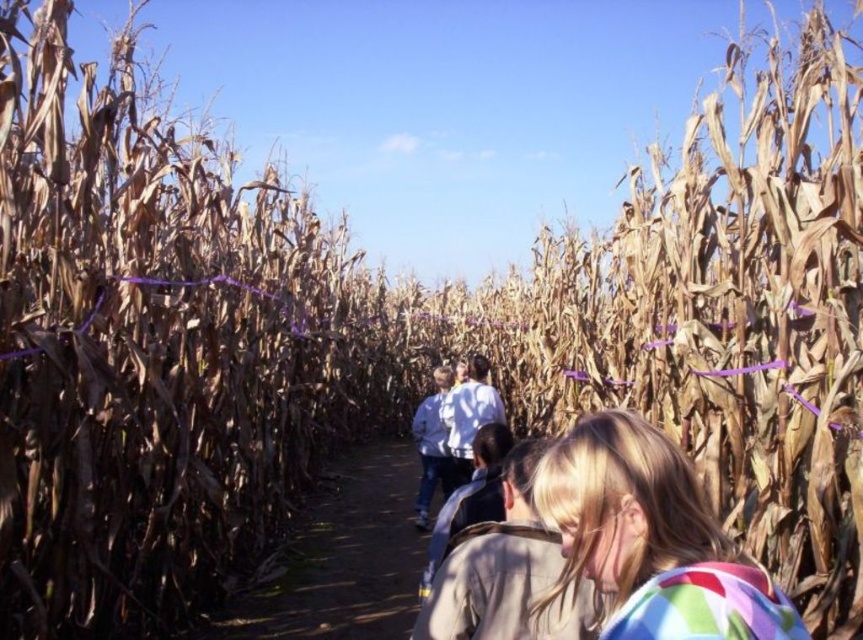
Can you confirm if multicolored fabric at lower right is bigger than blonde hair at center?

Incorrect, multicolored fabric at lower right is not larger than blonde hair at center.

Is multicolored fabric at lower right above blonde hair at center?

Correct, multicolored fabric at lower right is located above blonde hair at center.

What are the coordinates of `multicolored fabric at lower right` in the screenshot? It's located at (652, 538).

Based on the photo, does dirt path at center have a larger size compared to light blue denim jacket at center?

No.

The height and width of the screenshot is (640, 863). What do you see at coordinates (339, 560) in the screenshot? I see `dirt path at center` at bounding box center [339, 560].

Describe the element at coordinates (339, 560) in the screenshot. The height and width of the screenshot is (640, 863). I see `dirt path at center` at that location.

Identify the location of dirt path at center. (339, 560).

Is point (742, 563) less distant than point (263, 586)?

Yes, it is in front of point (263, 586).

Which is below, multicolored fabric at lower right or dirt path at center?

dirt path at center is below.

Is point (719, 566) more distant than point (317, 496)?

That is False.

Locate an element on the screen. The width and height of the screenshot is (863, 640). multicolored fabric at lower right is located at coordinates (652, 538).